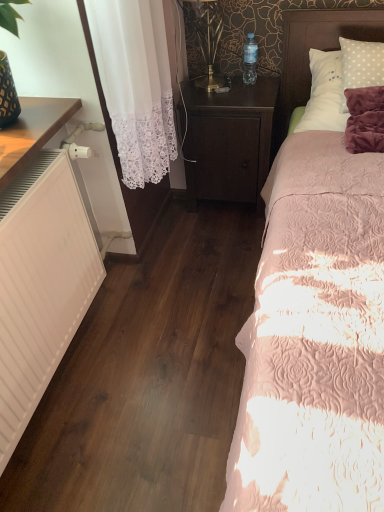
What are the coordinates of `free spot in front of dark wood nightstand at center` in the screenshot? It's located at (220, 234).